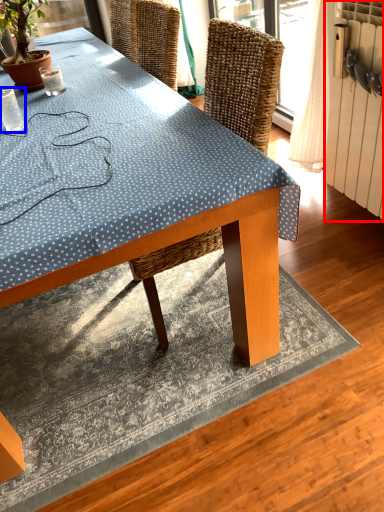
Question: Which point is further to the camera, radiator (highlighted by a red box) or coffee cup (highlighted by a blue box)?

Choices:
 (A) radiator
 (B) coffee cup

Answer: (B)